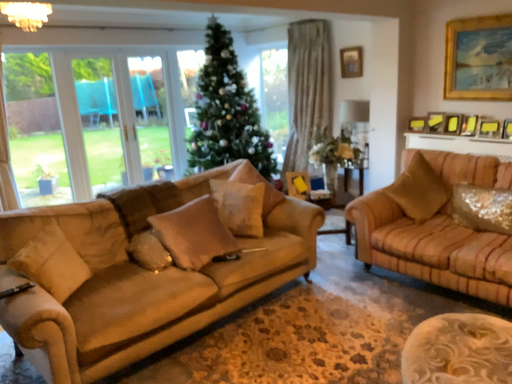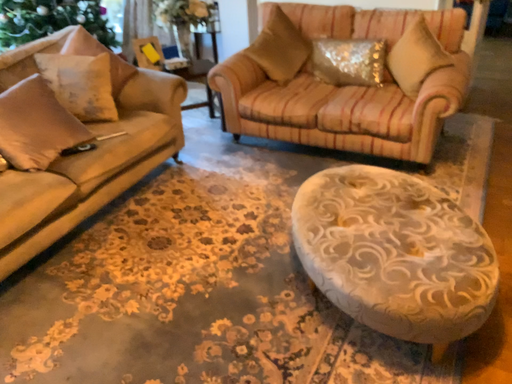
Question: How did the camera likely rotate when shooting the video?

Choices:
 (A) rotated downward
 (B) rotated upward

Answer: (A)